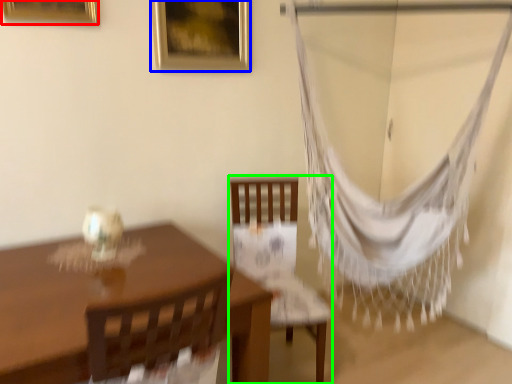
Question: Estimate the real-world distances between objects in this image. Which object is farther from picture frame (highlighted by a red box), picture frame (highlighted by a blue box) or chair (highlighted by a green box)?

Choices:
 (A) picture frame
 (B) chair

Answer: (B)